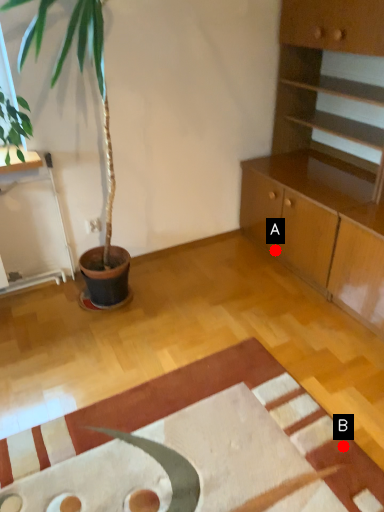
Question: Two points are circled on the image, labeled by A and B beside each circle. Among these points, which one is nearest to the camera?

Choices:
 (A) A is closer
 (B) B is closer

Answer: (B)